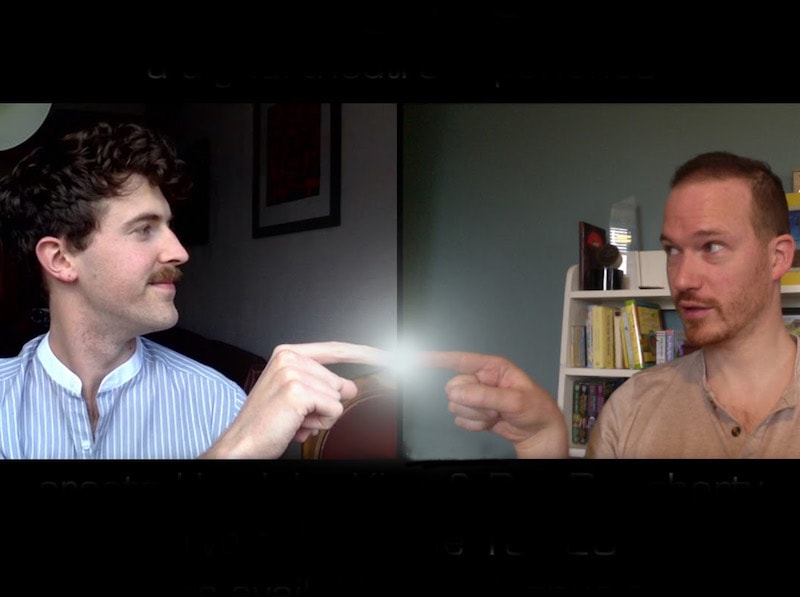
Locate an element on the screen. This screenshot has height=597, width=800. top shelf is located at coordinates (590, 291).